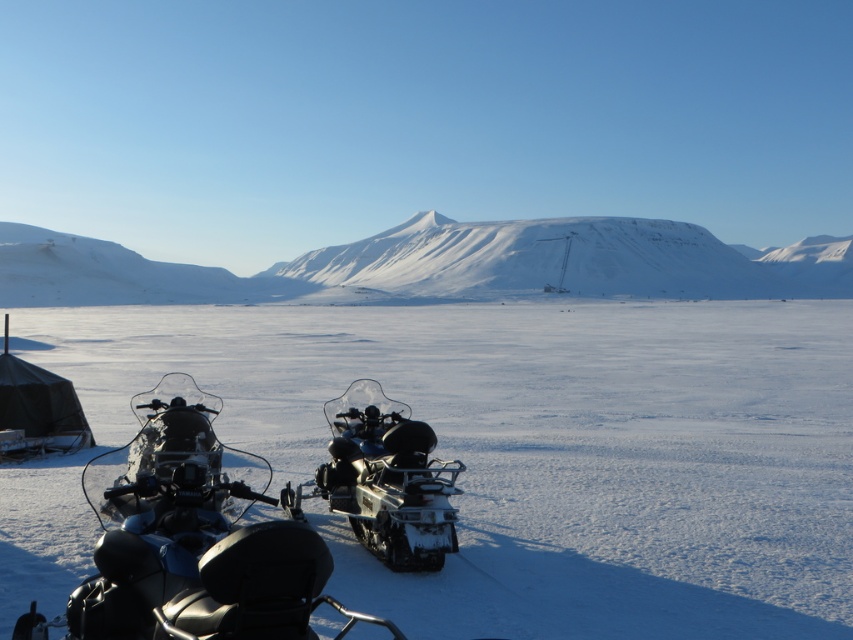
Can you confirm if white matte snow at center is positioned to the left of snowy white mountain at center?

Correct, you'll find white matte snow at center to the left of snowy white mountain at center.

Which is behind, point (479, 605) or point (849, 269)?

Positioned behind is point (849, 269).

You are a GUI agent. You are given a task and a screenshot of the screen. Output one action in this format:
    pyautogui.click(x=<x>, y=<y>)
    Task: Click on the white matte snow at center
    
    Given the screenshot: What is the action you would take?
    pyautogui.click(x=509, y=454)

Is snowy white mountain at center taller than black matte snowmobile at center?

Yes, snowy white mountain at center is taller than black matte snowmobile at center.

Does snowy white mountain at center have a greater width compared to black matte snowmobile at center?

Yes.

This screenshot has width=853, height=640. What do you see at coordinates (436, 264) in the screenshot? I see `snowy white mountain at center` at bounding box center [436, 264].

Image resolution: width=853 pixels, height=640 pixels. Identify the location of snowy white mountain at center. (x=436, y=264).

Is black matte snowmobile at center further to camera compared to black rubber snowmobile at center?

Yes, it is.

Describe the element at coordinates (190, 538) in the screenshot. This screenshot has height=640, width=853. I see `black matte snowmobile at center` at that location.

Who is more forward, (215,412) or (421,568)?

Point (421,568) is in front.

Where is `black matte snowmobile at center`? The image size is (853, 640). black matte snowmobile at center is located at coordinates (190, 538).